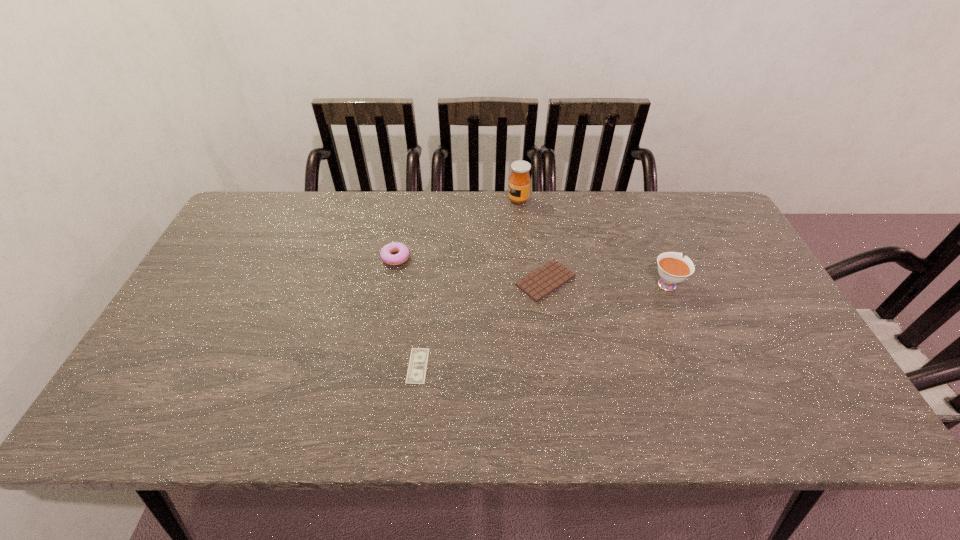
Where is `free location located on the front-facing side of the farthest object`? free location located on the front-facing side of the farthest object is located at coordinates (484, 200).

The width and height of the screenshot is (960, 540). Identify the location of vacant position located on the front-facing side of the farthest object. (491, 200).

Identify the location of vacant region located on the side of the teacup with the handle. The height and width of the screenshot is (540, 960). (652, 248).

This screenshot has height=540, width=960. I want to click on free space located on the side of the teacup with the handle, so click(652, 248).

Identify the location of free space located 0.070m on the side of the teacup with the handle. This screenshot has height=540, width=960. (654, 253).

Where is `free region located on the back of the leftmost object`? Image resolution: width=960 pixels, height=540 pixels. free region located on the back of the leftmost object is located at coordinates (401, 227).

I want to click on free region located on the left of the chocolate bar, so click(404, 281).

This screenshot has height=540, width=960. I want to click on vacant region located 0.360m on the back of the shortest object, so click(x=431, y=249).

Where is `object that is at the far edge`? This screenshot has width=960, height=540. object that is at the far edge is located at coordinates (519, 181).

Locate an element on the screen. free space at the far edge of the desktop is located at coordinates (576, 197).